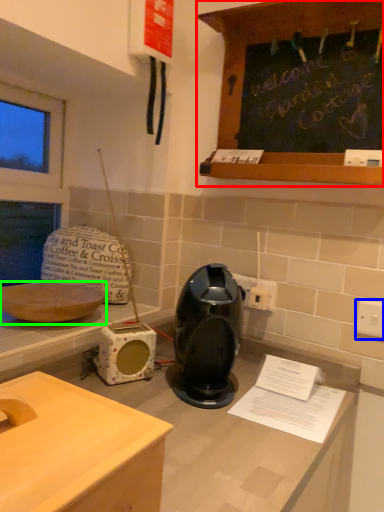
Question: Considering the real-world distances, which object is farthest from cabinetry (highlighted by a red box)? electric outlet (highlighted by a blue box) or kitchen appliance (highlighted by a green box)?

Choices:
 (A) electric outlet
 (B) kitchen appliance

Answer: (B)